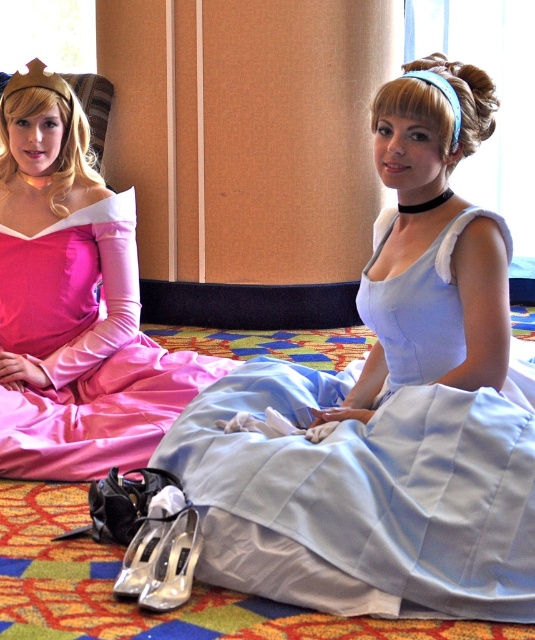
Is point (157, 609) positioned after point (170, 516)?

That is False.

The image size is (535, 640). What are the coordinates of `clear plastic shoe at lower center` in the screenshot? It's located at (172, 563).

Which is in front, point (521, 538) or point (141, 525)?

Positioned in front is point (521, 538).

Between point (518, 452) and point (141, 570), which one is positioned behind?

Positioned behind is point (518, 452).

Is point (500, 476) closer to camera compared to point (177, 515)?

Yes.

At what (x,y) coordinates should I click in order to perform the action: click on light blue satin dress at center. Please return your answer as a coordinate pair (x, y). The width and height of the screenshot is (535, 640). Looking at the image, I should click on (376, 461).

Looking at this image, does satin pink dress at left appear on the right side of silver metallic shoe at lower center?

In fact, satin pink dress at left is to the left of silver metallic shoe at lower center.

Between satin pink dress at left and silver metallic shoe at lower center, which one has less height?

silver metallic shoe at lower center

At what (x,y) coordinates should I click in order to perform the action: click on satin pink dress at left. Please return your answer as a coordinate pair (x, y). This screenshot has height=640, width=535. Looking at the image, I should click on (73, 301).